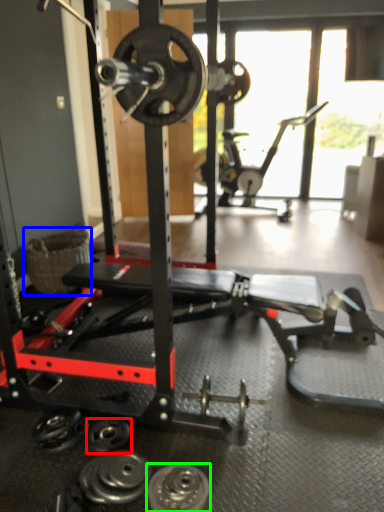
Question: Which object is positioned farthest from wheel (highlighted by a red box)? Select from basket (highlighted by a blue box) and wheel (highlighted by a green box).

Choices:
 (A) basket
 (B) wheel

Answer: (A)